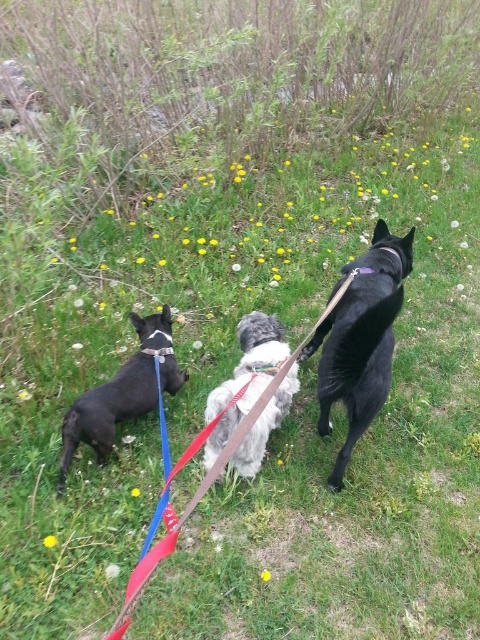
You are standing in the grassy area with three dogs on leashes. You see a shiny black dog at right represented by point (360,339). Where is the shiny black dog at right located in relation to the other dogs?

The shiny black dog at right is located at point (360,339), which is to the right of the other dogs.

You are a dog walker who needs to ensure all dogs are within a 2 meter leash length. Given the fluffy white dog at center and the brown leather leash at center, can you confirm if the leash is long enough to allow the dog to move freely without being restricted?

The fluffy white dog at center is shorter than the brown leather leash at center. Since the leash is longer than the dog, it should be long enough to allow the fluffy white dog at center to move freely within the 2 meter limit.